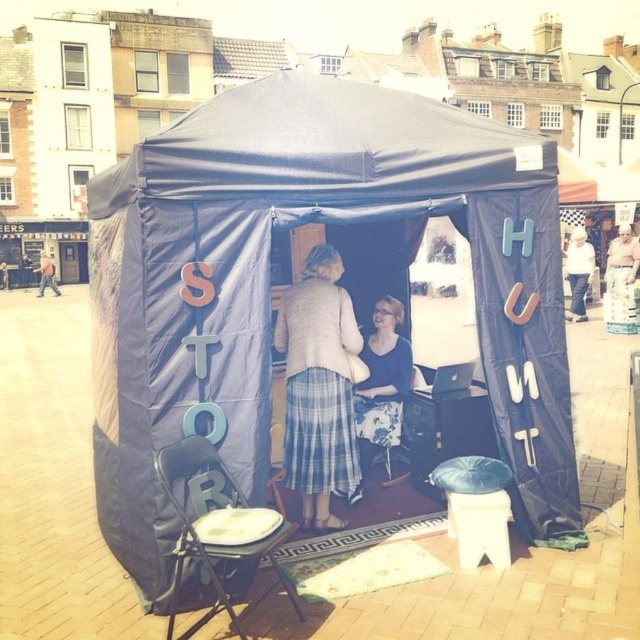
You are a photographer trying to capture a candid shot of the plaid skirt at center and the matte black jacket at left. Which object should you focus on first to ensure it fits entirely within your camera frame?

The plaid skirt at center occupies less space than the matte black jacket at left, so you should focus on capturing the matte black jacket at left first since it requires more space to fit entirely within the frame.

You are setting up a booth at an event and need to place the dark blue leather stool at center and the matte black jacket at left in a way that follows the scene description. Which object should be placed to the right of the other?

The dark blue leather stool at center is positioned on the right side of matte black jacket at left, so the dark blue leather stool at center should be placed to the right of the matte black jacket at left.